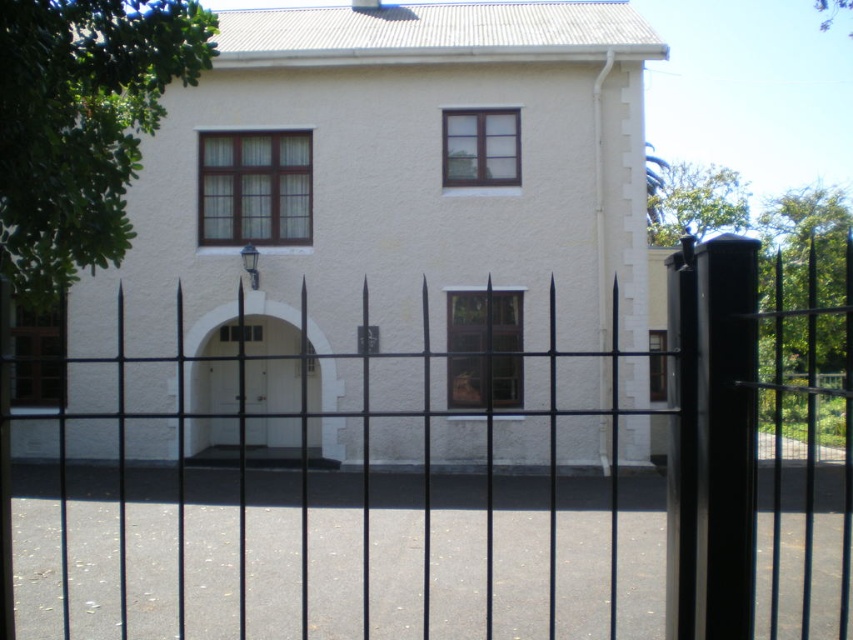
You are a delivery person trying to enter the building through the white matte door at center. The black metal fence at center is blocking your path. Can you pass through the gap between the fence and the door without bending sideways?

The black metal fence at center is wider than the white matte door at center, so the gap between them is narrow. You may need to bend sideways to pass through the gap between the black metal fence at center and the white matte door at center.

You are standing in front of the two story building with a black metal fence in front of it. You want to locate the point at coordinates (463, 497) on the image. Where would this point be located?

The point at coordinates (463, 497) corresponds to the black metal fence at center.

You are a delivery person trying to see the address number on the white matte door at center. The black metal fence at center is blocking your view. Can you see the address number clearly?

The black metal fence at center is taller than the white matte door at center, so the fence is blocking the view of the address number on the door.